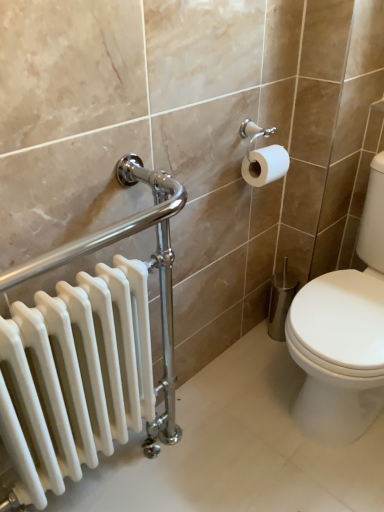
The height and width of the screenshot is (512, 384). Identify the location of free space to the left of white glossy toilet at right. (243, 403).